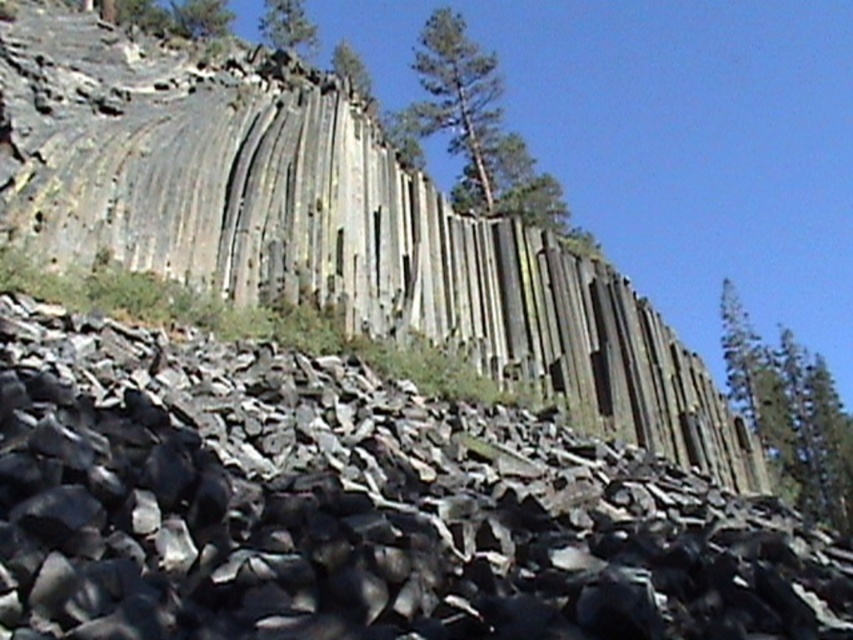
Question: Is green textured tree at upper right in front of green textured tree at upper center?

Choices:
 (A) no
 (B) yes

Answer: (A)

Question: Is green textured tree at upper right thinner than green textured tree at upper center?

Choices:
 (A) yes
 (B) no

Answer: (B)

Question: Which of the following is the farthest from the observer?

Choices:
 (A) gray rock formation at upper center
 (B) green textured tree at upper center
 (C) green leafy tree at upper center
 (D) black rock pile at lower left

Answer: (C)

Question: Which of the following is the closest to the observer?

Choices:
 (A) (367, 429)
 (B) (260, 166)
 (C) (753, 333)
 (D) (289, 19)

Answer: (A)

Question: Which of the following is the farthest from the observer?

Choices:
 (A) (440, 12)
 (B) (115, 609)

Answer: (A)

Question: Is green textured tree at upper center smaller than green leafy tree at upper center?

Choices:
 (A) no
 (B) yes

Answer: (A)